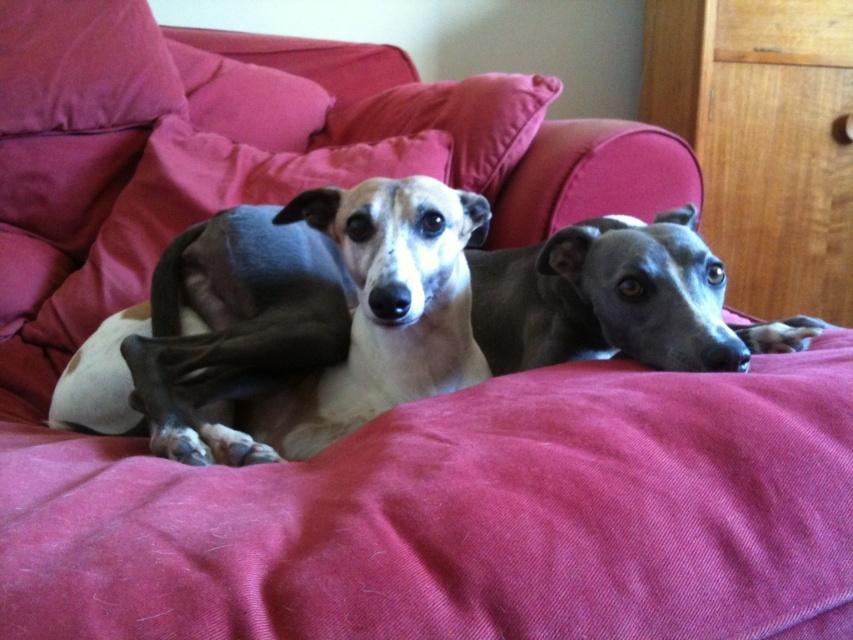
Question: Can you confirm if wooden dresser at upper right is positioned to the left of velvety pink pillow at left?

Choices:
 (A) yes
 (B) no

Answer: (B)

Question: Which point is farther to the camera?

Choices:
 (A) velvet cushion at upper center
 (B) light brown fur at center

Answer: (A)

Question: Which object is positioned closest to the wooden dresser at upper right?

Choices:
 (A) smooth gray dog at center
 (B) light brown fur at center
 (C) velvety pink pillow at left
 (D) velvety red dog bed at center

Answer: (C)

Question: Is light brown fur at center closer to the viewer compared to velvety pink pillow at left?

Choices:
 (A) no
 (B) yes

Answer: (B)

Question: Which of the following is the farthest from the observer?

Choices:
 (A) wooden dresser at upper right
 (B) light brown fur at center
 (C) velvety red dog bed at center

Answer: (A)

Question: Is velvety pink pillow at left smaller than velvet cushion at upper center?

Choices:
 (A) yes
 (B) no

Answer: (B)